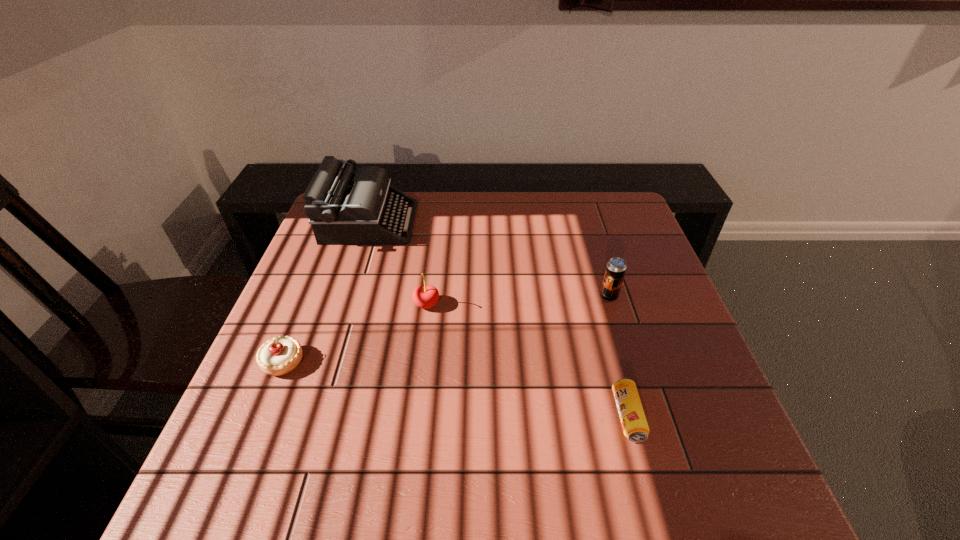
Identify the location of the farthest object. (344, 207).

Where is `typewriter`? typewriter is located at coordinates (344, 207).

This screenshot has width=960, height=540. I want to click on the third object from right to left, so click(425, 296).

The image size is (960, 540). Identify the location of the farther beer can. (616, 267).

At what (x,y) coordinates should I click in order to perform the action: click on the fourth tallest object. Please return your answer as a coordinate pair (x, y). Looking at the image, I should click on (280, 355).

This screenshot has width=960, height=540. Identify the location of pastry. (280, 355).

At what (x,y) coordinates should I click in order to perform the action: click on the shortest object. Please return your answer as a coordinate pair (x, y). This screenshot has height=540, width=960. Looking at the image, I should click on (635, 427).

Find the location of a particular element. the shorter beer can is located at coordinates (635, 427).

Image resolution: width=960 pixels, height=540 pixels. What are the coordinates of `free space located 0.130m on the typing side of the farthest object` in the screenshot? It's located at (455, 222).

This screenshot has height=540, width=960. Identify the location of vacant space located 0.270m on the back of the cherry. (436, 233).